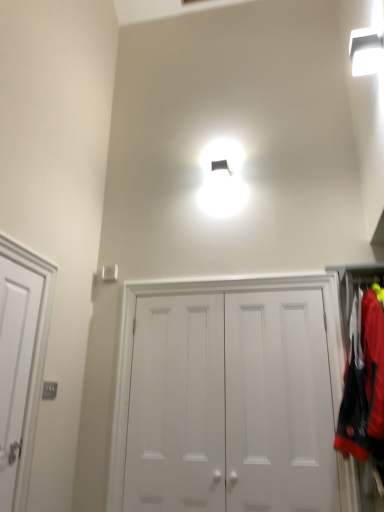
What are the coordinates of `white matte door at center, which ranks as the 3th door in left-to-right order` in the screenshot? It's located at (231, 404).

The image size is (384, 512). What do you see at coordinates (177, 406) in the screenshot? I see `white matte door at center, the 2th door from the left` at bounding box center [177, 406].

This screenshot has height=512, width=384. What do you see at coordinates (363, 383) in the screenshot?
I see `red fabric laundry at right` at bounding box center [363, 383].

At what (x,y) coordinates should I click in order to perform the action: click on white matte door at center, which ranks as the 3th door in left-to-right order. Please return your answer as a coordinate pair (x, y). This screenshot has height=512, width=384. Looking at the image, I should click on (231, 404).

From a real-world perspective, does white matte door at center, marked as the 2th door in a right-to-left arrangement, sit lower than red fabric laundry at right?

Correct, in the physical world, white matte door at center, marked as the 2th door in a right-to-left arrangement, is lower than red fabric laundry at right.

Is point (160, 410) positioned after point (367, 373)?

Yes, point (160, 410) is farther from viewer.

Based on the photo, who is more distant, white matte door at center, marked as the 2th door in a right-to-left arrangement, or red fabric laundry at right?

white matte door at center, marked as the 2th door in a right-to-left arrangement, is further away from the camera.

This screenshot has width=384, height=512. I want to click on laundry lying on the right of white matte door at center, the 2th door from the left, so click(363, 383).

From the image's perspective, is white matte door at center, which ranks as the 3th door in left-to-right order, over white matte door at left, which is the first door from left to right?

No.

Find the location of a particular element. The image size is (384, 512). the 1st door behind the white matte door at left, which is the first door from left to right, starting your count from the anchor is located at coordinates (231, 404).

Between white matte door at center, placed as the first door when sorted from right to left, and white matte door at left, which is the first door from left to right, which one is positioned in front?

white matte door at left, which is the first door from left to right, is in front.

Is white matte door at center, which ranks as the 3th door in left-to-right order, surrounding white matte door at left, which is the first door from left to right?

No, white matte door at left, which is the first door from left to right, is not surrounded by white matte door at center, which ranks as the 3th door in left-to-right order.

Considering their positions, is white matte door at left, which is the first door from left to right, located in front of or behind red fabric laundry at right?

In the image, white matte door at left, which is the first door from left to right, appears in front of red fabric laundry at right.

Is white matte door at left, positioned as the third door in right-to-left order, wider or thinner than red fabric laundry at right?

Considering their sizes, white matte door at left, positioned as the third door in right-to-left order, looks slimmer than red fabric laundry at right.

From the image's perspective, would you say white matte door at left, which is the first door from left to right, is positioned over red fabric laundry at right?

No, from the image's perspective, white matte door at left, which is the first door from left to right, is not above red fabric laundry at right.

Does white matte door at left, which is the first door from left to right, have a smaller size compared to red fabric laundry at right?

Yes.

Which of these two, white matte door at center, the 2th door from the left, or white matte door at center, placed as the first door when sorted from right to left, is wider?

Wider between the two is white matte door at center, the 2th door from the left.

Is white matte door at center, the 2th door from the left, oriented away from white matte door at center, which ranks as the 3th door in left-to-right order?

Yes, white matte door at center, the 2th door from the left, is positioned with its back facing white matte door at center, which ranks as the 3th door in left-to-right order.

From the image's perspective, which is below, white matte door at center, the 2th door from the left, or white matte door at center, placed as the first door when sorted from right to left?

From the image's view, white matte door at center, the 2th door from the left, is below.

Is red fabric laundry at right smaller than white matte door at center, marked as the 2th door in a right-to-left arrangement?

No, red fabric laundry at right is not smaller than white matte door at center, marked as the 2th door in a right-to-left arrangement.

Which of these two, red fabric laundry at right or white matte door at center, marked as the 2th door in a right-to-left arrangement, is wider?

red fabric laundry at right.

From a real-world perspective, is red fabric laundry at right below white matte door at center, the 2th door from the left?

Incorrect, from a real-world perspective, red fabric laundry at right is higher than white matte door at center, the 2th door from the left.

Which object is positioned more to the right, red fabric laundry at right or white matte door at center, marked as the 2th door in a right-to-left arrangement?

Positioned to the right is red fabric laundry at right.

In the image, is red fabric laundry at right on the left side or the right side of white matte door at left, positioned as the third door in right-to-left order?

red fabric laundry at right is to the right of white matte door at left, positioned as the third door in right-to-left order.

Between red fabric laundry at right and white matte door at left, which is the first door from left to right, which one has smaller width?

Thinner between the two is white matte door at left, which is the first door from left to right.

Is red fabric laundry at right far away from white matte door at left, which is the first door from left to right?

red fabric laundry at right is positioned a significant distance from white matte door at left, which is the first door from left to right.

Do you think red fabric laundry at right is within white matte door at left, which is the first door from left to right, or outside of it?

red fabric laundry at right lies outside white matte door at left, which is the first door from left to right.

Is white matte door at left, positioned as the third door in right-to-left order, facing towards white matte door at center, placed as the first door when sorted from right to left?

No, white matte door at left, positioned as the third door in right-to-left order, is not oriented towards white matte door at center, placed as the first door when sorted from right to left.

Is point (8, 442) closer or farther from the camera than point (143, 416)?

Point (8, 442) is closer to the camera than point (143, 416).

Can you confirm if white matte door at left, positioned as the third door in right-to-left order, is bigger than white matte door at center, which ranks as the 3th door in left-to-right order?

No, white matte door at left, positioned as the third door in right-to-left order, is not bigger than white matte door at center, which ranks as the 3th door in left-to-right order.

Is white matte door at left, which is the first door from left to right, to the left of white matte door at center, placed as the first door when sorted from right to left, from the viewer's perspective?

Correct, you'll find white matte door at left, which is the first door from left to right, to the left of white matte door at center, placed as the first door when sorted from right to left.

Locate an element on the screen. Image resolution: width=384 pixels, height=512 pixels. the 2nd door behind the red fabric laundry at right is located at coordinates (177, 406).

Locate an element on the screen. the 2nd door to the right when counting from the white matte door at left, positioned as the third door in right-to-left order is located at coordinates (231, 404).

From the image, which object appears to be nearer to white matte door at center, which ranks as the 3th door in left-to-right order, white matte door at left, which is the first door from left to right, or white matte door at center, marked as the 2th door in a right-to-left arrangement?

white matte door at center, marked as the 2th door in a right-to-left arrangement, is closer to white matte door at center, which ranks as the 3th door in left-to-right order.

When comparing their distances from white matte door at center, the 2th door from the left, does white matte door at center, which ranks as the 3th door in left-to-right order, or white matte door at left, positioned as the third door in right-to-left order, seem closer?

white matte door at center, which ranks as the 3th door in left-to-right order.

Which object lies nearer to the anchor point white matte door at left, positioned as the third door in right-to-left order, red fabric laundry at right or white matte door at center, placed as the first door when sorted from right to left?

white matte door at center, placed as the first door when sorted from right to left, is closer to white matte door at left, positioned as the third door in right-to-left order.

Looking at the image, which one is located closer to white matte door at left, which is the first door from left to right, white matte door at center, the 2th door from the left, or white matte door at center, placed as the first door when sorted from right to left?

The object closer to white matte door at left, which is the first door from left to right, is white matte door at center, the 2th door from the left.

When comparing their distances from white matte door at center, placed as the first door when sorted from right to left, does white matte door at center, the 2th door from the left, or red fabric laundry at right seem further?

Among the two, red fabric laundry at right is located further to white matte door at center, placed as the first door when sorted from right to left.

Considering their positions, is red fabric laundry at right positioned closer to white matte door at center, the 2th door from the left, than white matte door at center, which ranks as the 3th door in left-to-right order?

white matte door at center, which ranks as the 3th door in left-to-right order, is positioned closer to the anchor white matte door at center, the 2th door from the left.

Based on their spatial positions, is red fabric laundry at right or white matte door at center, marked as the 2th door in a right-to-left arrangement, further from white matte door at left, positioned as the third door in right-to-left order?

Based on the image, red fabric laundry at right appears to be further to white matte door at left, positioned as the third door in right-to-left order.

From the image, which object appears to be nearer to white matte door at left, positioned as the third door in right-to-left order, white matte door at center, placed as the first door when sorted from right to left, or red fabric laundry at right?

white matte door at center, placed as the first door when sorted from right to left, is positioned closer to the anchor white matte door at left, positioned as the third door in right-to-left order.

I want to click on door between white matte door at center, the 2th door from the left, and red fabric laundry at right, so click(x=231, y=404).

What are the coordinates of `door between white matte door at left, positioned as the third door in right-to-left order, and white matte door at center, placed as the first door when sorted from right to left, from left to right` in the screenshot? It's located at (177, 406).